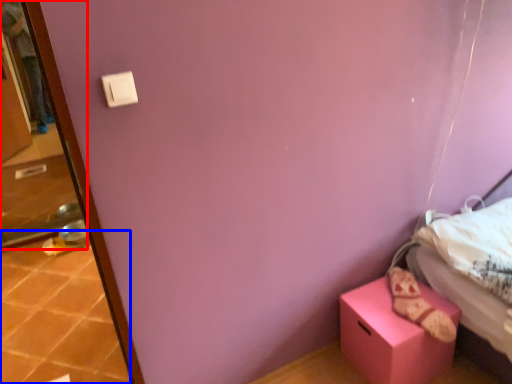
Question: Which object is closer to the camera taking this photo, screen door (highlighted by a red box) or tile (highlighted by a blue box)?

Choices:
 (A) screen door
 (B) tile

Answer: (B)